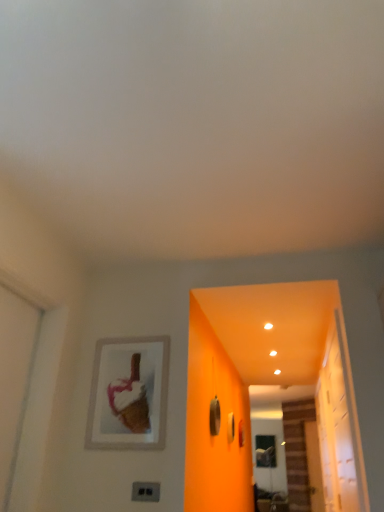
Question: Are black plastic electric outlet at lower center and transparent glass door at right beside each other?

Choices:
 (A) yes
 (B) no

Answer: (B)

Question: Is black plastic electric outlet at lower center wider than transparent glass door at right?

Choices:
 (A) no
 (B) yes

Answer: (A)

Question: Is black plastic electric outlet at lower center not inside transparent glass door at right?

Choices:
 (A) no
 (B) yes

Answer: (B)

Question: Is black plastic electric outlet at lower center looking in the opposite direction of transparent glass door at right?

Choices:
 (A) yes
 (B) no

Answer: (B)

Question: Can you confirm if black plastic electric outlet at lower center is bigger than transparent glass door at right?

Choices:
 (A) no
 (B) yes

Answer: (A)

Question: Is black plastic electric outlet at lower center not close to transparent glass door at right?

Choices:
 (A) no
 (B) yes

Answer: (B)

Question: Does matte silver picture frame at upper left contain black plastic electric outlet at lower center?

Choices:
 (A) no
 (B) yes

Answer: (A)

Question: Does matte silver picture frame at upper left come behind black plastic electric outlet at lower center?

Choices:
 (A) no
 (B) yes

Answer: (B)

Question: Does matte silver picture frame at upper left have a smaller size compared to black plastic electric outlet at lower center?

Choices:
 (A) no
 (B) yes

Answer: (A)

Question: Does matte silver picture frame at upper left have a greater height compared to black plastic electric outlet at lower center?

Choices:
 (A) no
 (B) yes

Answer: (B)

Question: Is the position of matte silver picture frame at upper left less distant than that of black plastic electric outlet at lower center?

Choices:
 (A) no
 (B) yes

Answer: (A)

Question: Considering the relative sizes of matte silver picture frame at upper left and black plastic electric outlet at lower center in the image provided, is matte silver picture frame at upper left wider than black plastic electric outlet at lower center?

Choices:
 (A) no
 (B) yes

Answer: (B)

Question: Is transparent glass screen door at lower right outside of matte silver picture frame at upper left?

Choices:
 (A) no
 (B) yes

Answer: (B)